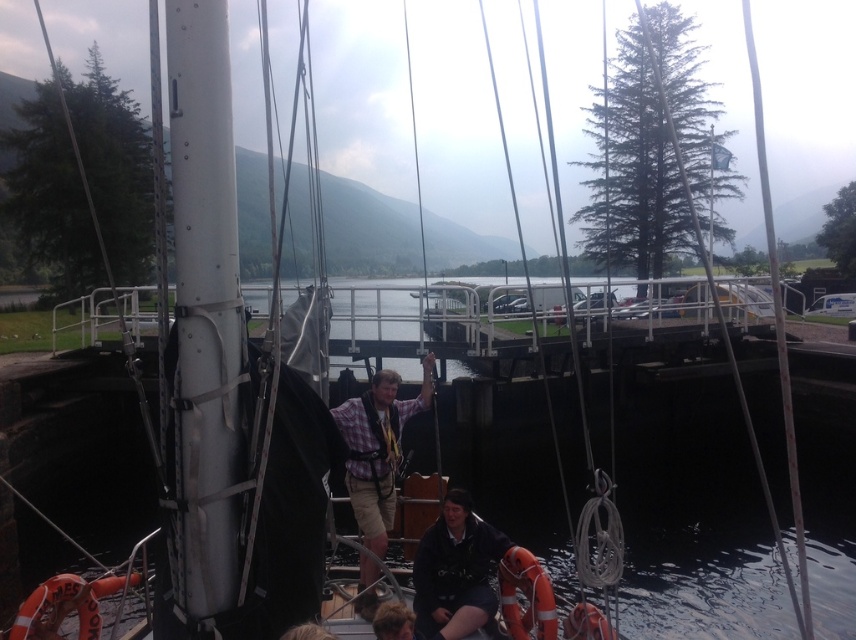
Between point (390, 429) and point (467, 586), which one is positioned behind?

Positioned behind is point (390, 429).

Is plaid fabric shirt at center further to the viewer compared to dark blue fabric at lower center?

Yes.

Identify the location of plaid fabric shirt at center. (377, 449).

Can you confirm if dark blue fabric at lower center is thinner than brown hair at lower center?

Incorrect, dark blue fabric at lower center's width is not less than brown hair at lower center's.

Does point (459, 566) come farther from viewer compared to point (379, 627)?

That is True.

Locate an element on the screen. The height and width of the screenshot is (640, 856). dark blue fabric at lower center is located at coordinates (455, 572).

Which of these two, plaid fabric shirt at center or brown hair at lower center, stands taller?

plaid fabric shirt at center

Does plaid fabric shirt at center appear under brown hair at lower center?

Incorrect, plaid fabric shirt at center is not positioned below brown hair at lower center.

Is point (373, 608) more distant than point (393, 602)?

Yes, it is.

Where is `plaid fabric shirt at center`? plaid fabric shirt at center is located at coordinates 377,449.